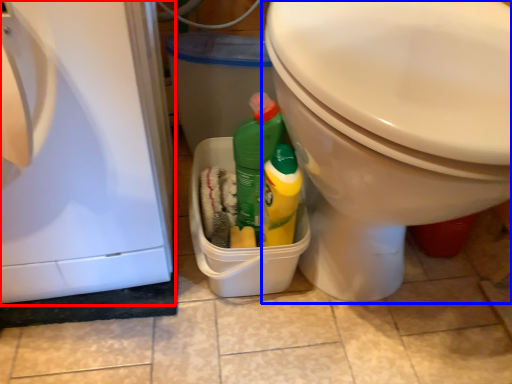
Question: Which object is further to the camera taking this photo, dish washer (highlighted by a red box) or toilet (highlighted by a blue box)?

Choices:
 (A) dish washer
 (B) toilet

Answer: (B)